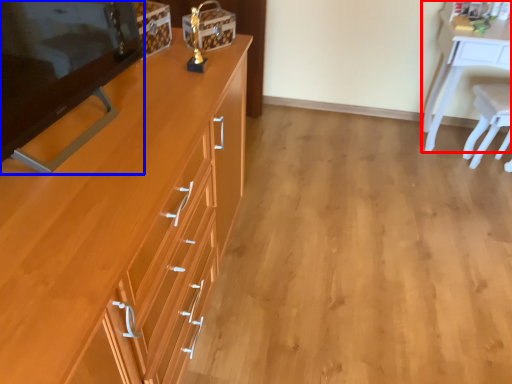
Question: Which object appears closest to the camera in this image, desk (highlighted by a red box) or changing table (highlighted by a blue box)?

Choices:
 (A) desk
 (B) changing table

Answer: (B)